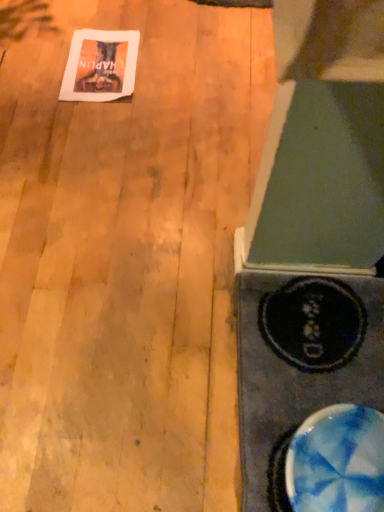
Image resolution: width=384 pixels, height=512 pixels. I want to click on free point in front of white paper at upper left, so point(96,132).